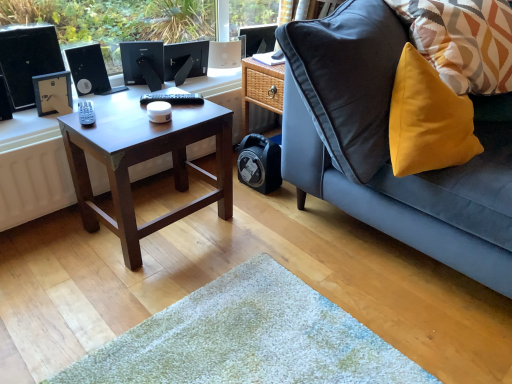
Question: Is satin black monitor at upper center, the second computer monitor positioned from the left, situated inside black matte desktop computer at left or outside?

Choices:
 (A) outside
 (B) inside

Answer: (A)

Question: Is satin black monitor at upper center, the second computer monitor positioned from the left, taller or shorter than black matte desktop computer at left?

Choices:
 (A) short
 (B) tall

Answer: (A)

Question: Which object is the farthest from the satin black monitor at center, the first computer monitor from the left?

Choices:
 (A) dark brown wood coffee table at center
 (B) matte black monitor at upper center, the third computer monitor when ordered from left to right
 (C) mustard yellow fabric pillow at right
 (D) yellow fabric pillow at upper right
 (E) satin black monitor at upper center, the second computer monitor positioned from the left

Answer: (D)

Question: Which is farther from the black matte desktop computer at left?

Choices:
 (A) dark brown wood coffee table at center
 (B) satin black monitor at upper center, the second computer monitor positioned from the left
 (C) yellow fabric pillow at upper right
 (D) black plastic computer at upper left
 (E) mustard yellow fabric pillow at right

Answer: (C)